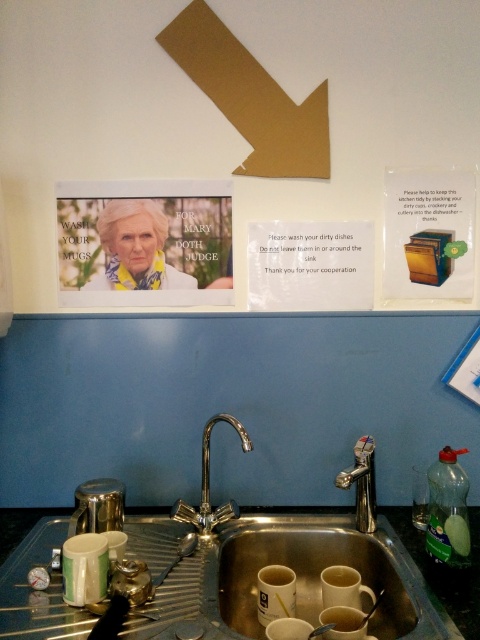
You are standing in the kitchen and want to reach the silver metallic sink at center to wash your hands. If your arm can extend 36 inches, can you comfortably reach it without moving closer?

The silver metallic sink at center is 38.04 inches away from the camera, which is slightly beyond your arm extension of 36 inches. You would need to move closer to comfortably reach it.

From the picture: You are trying to determine which object is taller between the silver metallic sink at center and the gold cardboard arrow at upper center. Based on the scene, which one is taller?

The silver metallic sink at center is taller than the gold cardboard arrow at upper center according to the description.